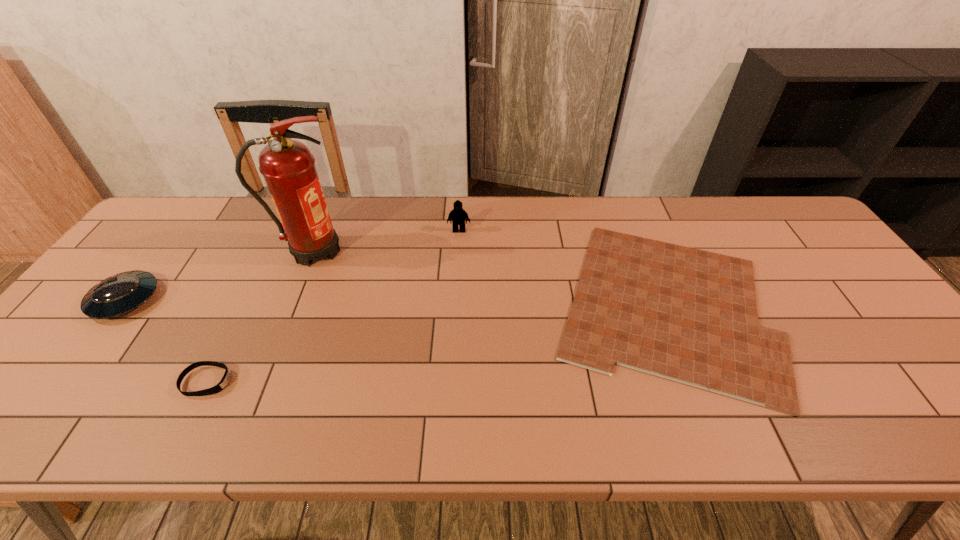
Identify the location of free spot between the shortest object and the third tallest object. (394, 302).

I want to click on vacant area between the second tallest object and the shortest object, so click(x=561, y=268).

In order to click on free space between the wristband and the saucer in this screenshot , I will do `click(166, 341)`.

Where is `vacant area that lies between the fire extinguisher and the third shortest object`? This screenshot has height=540, width=960. vacant area that lies between the fire extinguisher and the third shortest object is located at coordinates (219, 275).

Identify which object is the nearest to the gameboard. Please provide its 2D coordinates. Your answer should be formatted as a tuple, i.e. [(x, y)], where the tuple contains the x and y coordinates of a point satisfying the conditions above.

[(457, 216)]

Choose which object is the second nearest neighbor to the wristband. Please provide its 2D coordinates. Your answer should be formatted as a tuple, i.e. [(x, y)], where the tuple contains the x and y coordinates of a point satisfying the conditions above.

[(288, 167)]

At what (x,y) coordinates should I click in order to perform the action: click on free region that satisfies the following two spatial constraints: 1. on the front side of the gameboard; 2. on the display of the second shortest object. Please return your answer as a coordinate pair (x, y). Looking at the image, I should click on coord(693,381).

What are the coordinates of `vacant region that satisfies the following two spatial constraints: 1. on the face of the second object from right to left; 2. on the display of the wristband` in the screenshot? It's located at (451, 381).

What are the coordinates of `vacant region that satisfies the following two spatial constraints: 1. on the front side of the rightmost object; 2. on the right side of the third tallest object` in the screenshot? It's located at (121, 305).

Find the location of `free spot that satisfies the following two spatial constraints: 1. on the front-facing side of the fire extinguisher; 2. on the front side of the leftmost object`. free spot that satisfies the following two spatial constraints: 1. on the front-facing side of the fire extinguisher; 2. on the front side of the leftmost object is located at coordinates (294, 300).